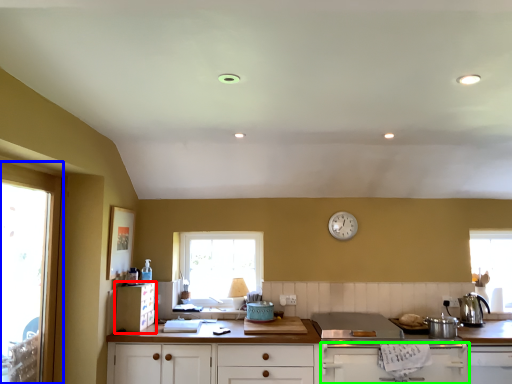
Question: Based on their relative distances, which object is nearer to cabinetry (highlighted by a red box)? Choose from window (highlighted by a blue box) and cabinetry (highlighted by a green box).

Choices:
 (A) window
 (B) cabinetry

Answer: (A)